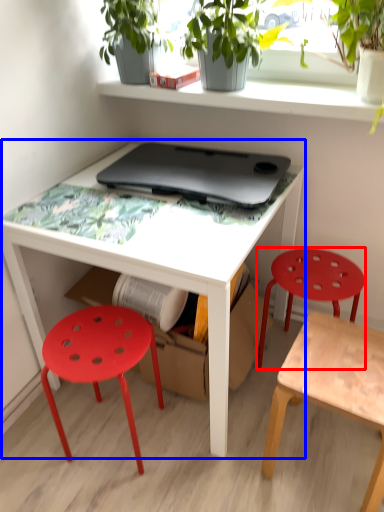
Question: Which object appears farthest to the camera in this image, stool (highlighted by a red box) or table (highlighted by a blue box)?

Choices:
 (A) stool
 (B) table

Answer: (A)